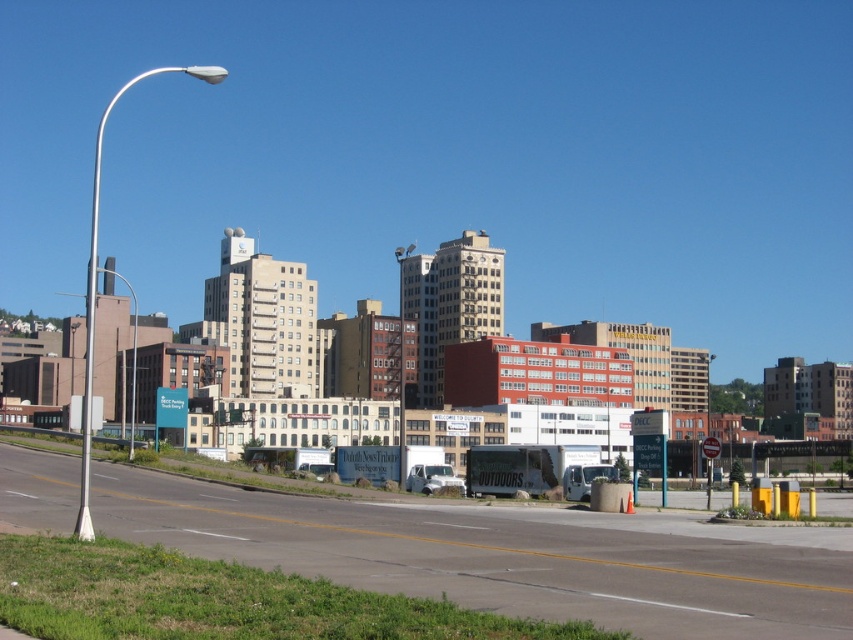
Question: Does white metallic pole at left appear over metallic gray pole at left?

Choices:
 (A) yes
 (B) no

Answer: (A)

Question: Which point is closer to the camera taking this photo?

Choices:
 (A) (93, 204)
 (B) (131, 292)

Answer: (A)

Question: Is white metallic pole at left closer to camera compared to metallic gray pole at left?

Choices:
 (A) yes
 (B) no

Answer: (A)

Question: Among these points, which one is nearest to the camera?

Choices:
 (A) click(134, 362)
 (B) click(88, 480)

Answer: (B)

Question: Does white metallic pole at left appear under metallic gray pole at left?

Choices:
 (A) yes
 (B) no

Answer: (B)